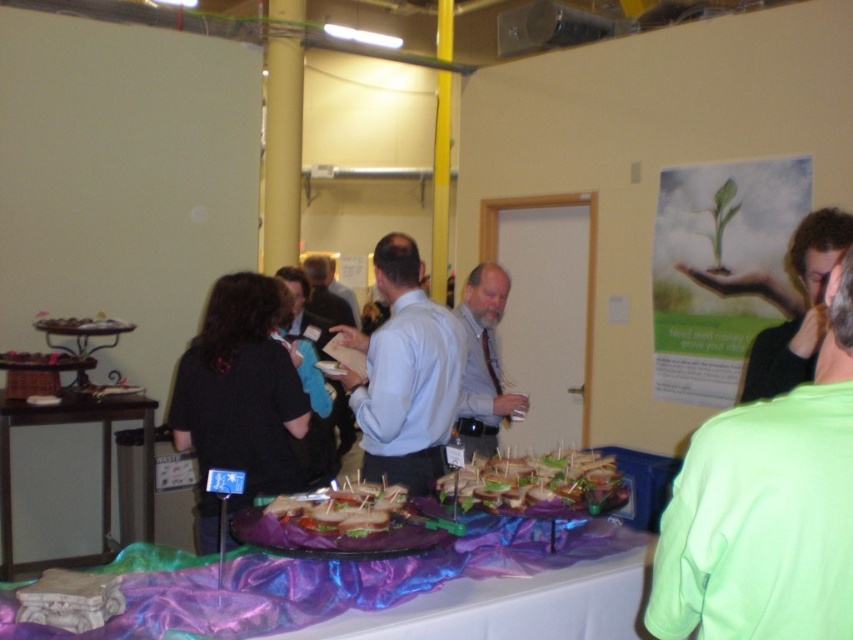
Consider the image. You are standing in the center of the room and want to greet the person wearing the light blue shirt at center. In which direction should you walk to reach them?

The light blue shirt at center is located at point coordinates of 0.586 on the x axis and 0.475 on the y axis. Since you are standing at the center of the room, you should walk towards the direction of the coordinates to reach the person.

You are organizing a buffet table and need to place a new dish between the green fabric at center and the matte brown bread at center. According to the image, where should you position the dish relative to these two items?

The green fabric at center is located above the matte brown bread at center, so you should place the new dish between them by positioning it below the green fabric at center and above the matte brown bread at center.

Based on the photo, you are at a conference and need to exit the room. You see a wooden door at center and a green leafy sandwich at center. Which object is positioned to the right of the other?

The wooden door at center is to the right of the green leafy sandwich at center, so the wooden door is positioned to the right of the green leafy sandwich.